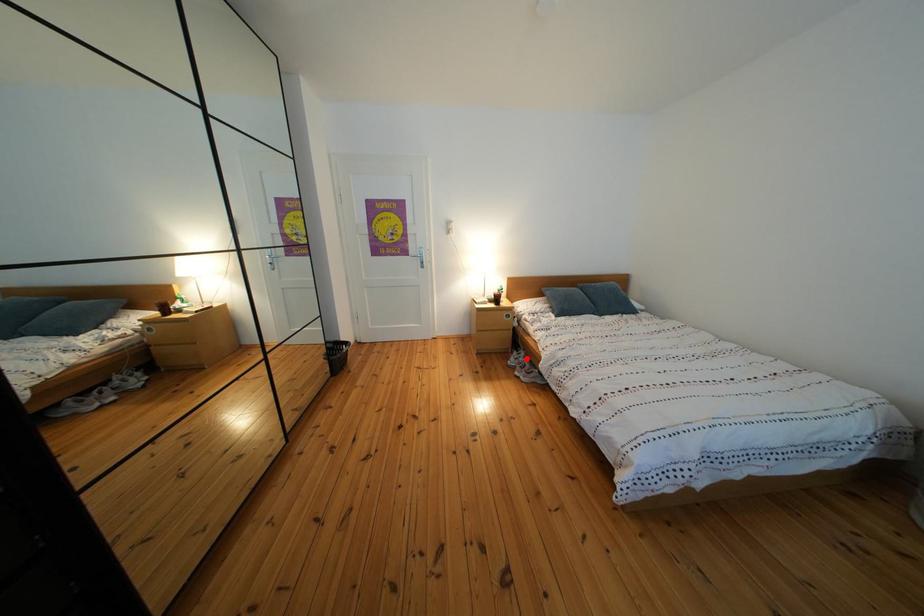
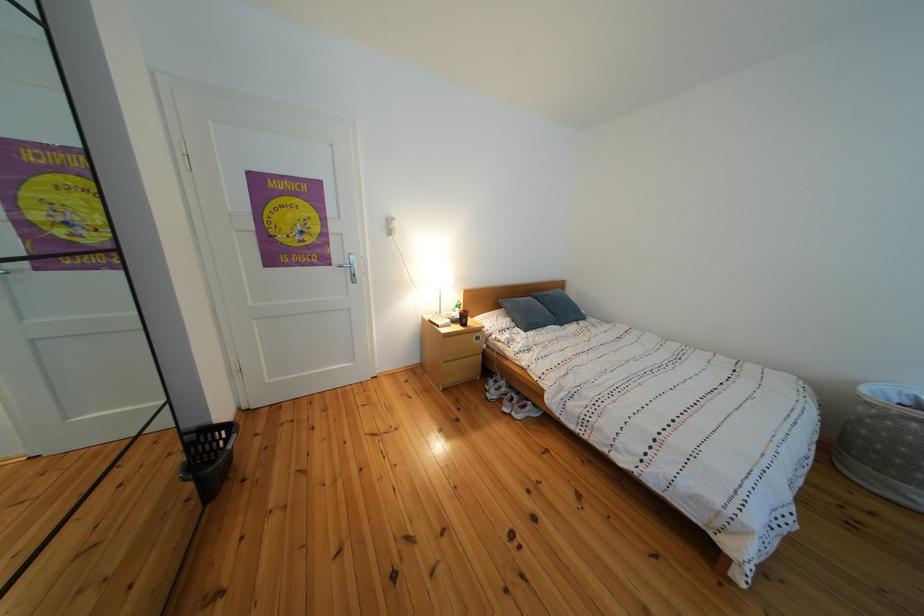
The point at the highlighted location is marked in the first image. Where is the corresponding point in the second image?

(503, 387)